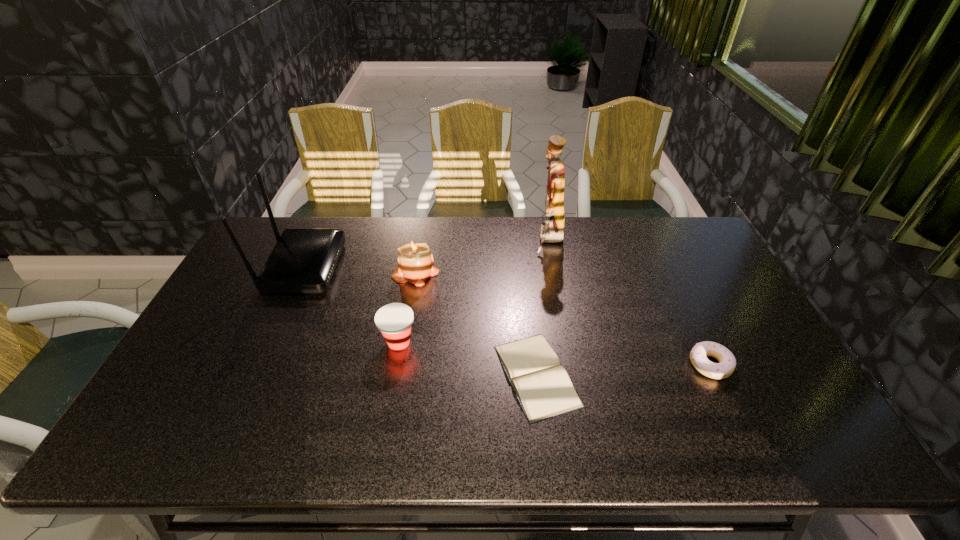
You are a GUI agent. You are given a task and a screenshot of the screen. Output one action in this format:
    pyautogui.click(x=<x>, y=<y>)
    Task: Click on the free space that satisfies the following two spatial constraints: 1. on the front side of the Dixie cup; 2. on the right side of the doughnut
    This screenshot has height=540, width=960.
    Given the screenshot: What is the action you would take?
    pyautogui.click(x=395, y=364)

Where is `free region that satisfies the following two spatial constraints: 1. on the front-facing side of the tallest object; 2. on the left side of the doughnut`? free region that satisfies the following two spatial constraints: 1. on the front-facing side of the tallest object; 2. on the left side of the doughnut is located at coordinates (573, 364).

This screenshot has width=960, height=540. I want to click on vacant area that satisfies the following two spatial constraints: 1. on the front side of the candle; 2. on the right side of the shortest object, so click(x=399, y=375).

Locate an element on the screen. Image resolution: width=960 pixels, height=540 pixels. free space that satisfies the following two spatial constraints: 1. on the front-facing side of the router; 2. on the right side of the fourth shortest object is located at coordinates (300, 272).

What are the coordinates of `free spot that satisfies the following two spatial constraints: 1. on the front-facing side of the leftmost object; 2. on the left side of the candle` in the screenshot? It's located at (300, 272).

Where is `vacant position in the image that satisfies the following two spatial constraints: 1. on the front-facing side of the candle; 2. on the left side of the router`? This screenshot has width=960, height=540. vacant position in the image that satisfies the following two spatial constraints: 1. on the front-facing side of the candle; 2. on the left side of the router is located at coordinates (300, 272).